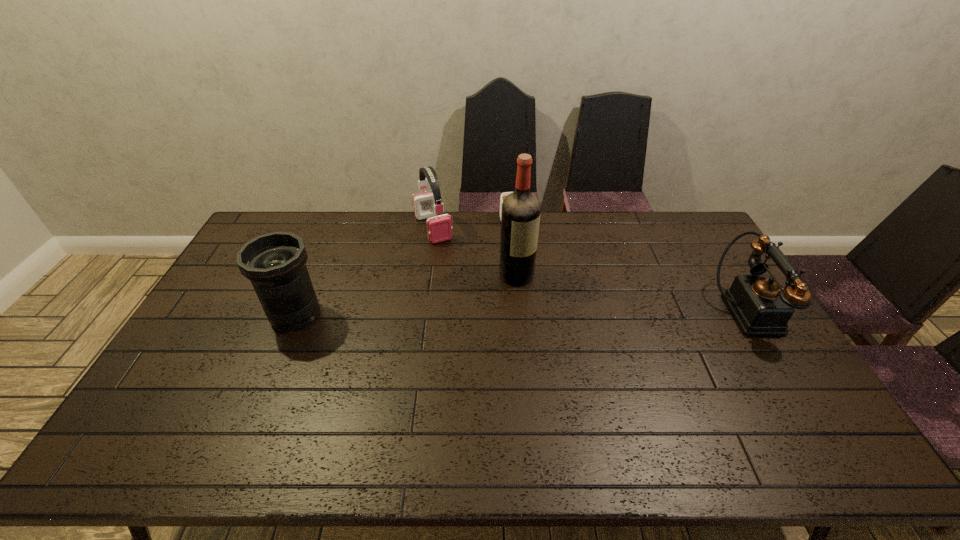
I want to click on free space on the desktop that is between the leftmost object and the telephone and is positioned on the front-facing side of the liquor, so click(x=582, y=313).

Image resolution: width=960 pixels, height=540 pixels. In order to click on free space on the desktop that is between the leftmost object and the rightmost object and is positioned on the outer surface of the second object from left to right in this screenshot , I will do `click(484, 313)`.

In order to click on free spot on the desktop that is between the telephoto lens and the rightmost object and is positioned on the side with the handle of the shortest object in this screenshot , I will do `click(532, 313)`.